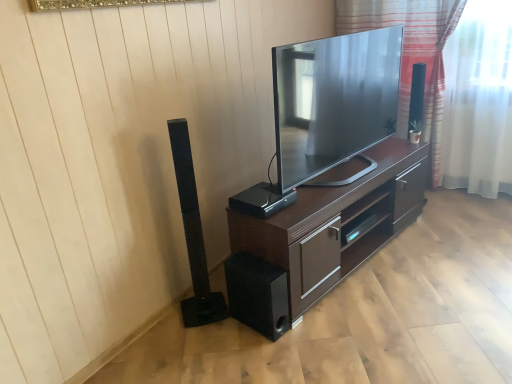
This screenshot has height=384, width=512. What are the coordinates of `vacant space in between black matte speaker at left, the third speaker from the right, and black matte speaker at lower center, the 2th speaker positioned from the right` in the screenshot? It's located at (228, 331).